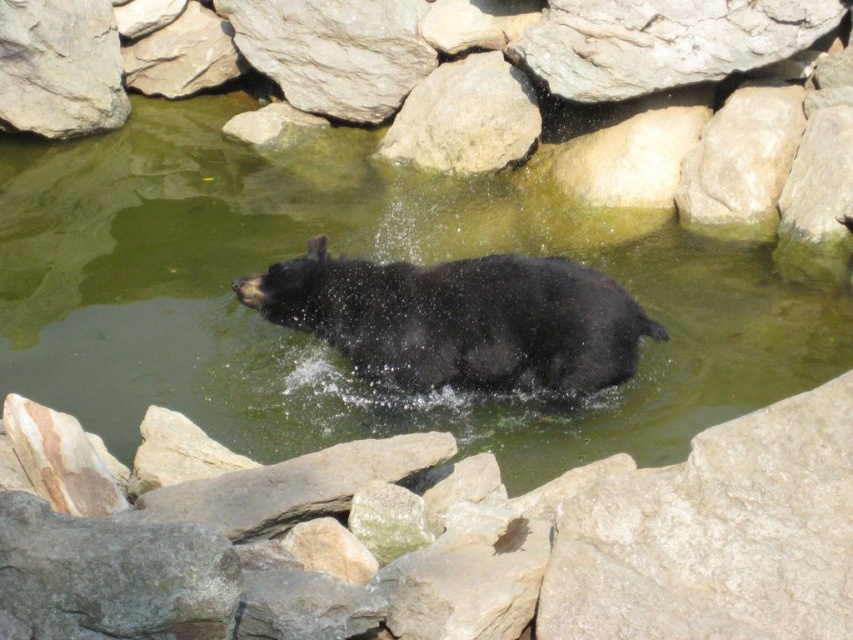
You are a photographer trying to capture the black bear swimming between the gray rough rock at lower right and the rough gray rock at upper left. Which rock should you position yourself closer to in order to frame the bear in the center of your shot?

You should position yourself closer to the rough gray rock at upper left because the gray rough rock at lower right is to the right of it, so centering the bear between them would require positioning closer to the upper left rock.

You are a photographer trying to capture the black matte bear at center swimming between the gray rough rock at lower right. Since you want to ensure the bear is the main focus, which object should you zoom in on more to make it appear larger in the photo?

The black matte bear at center should be zoomed in on more because it is thicker than the gray rough rock at lower right, making it naturally larger in the frame.